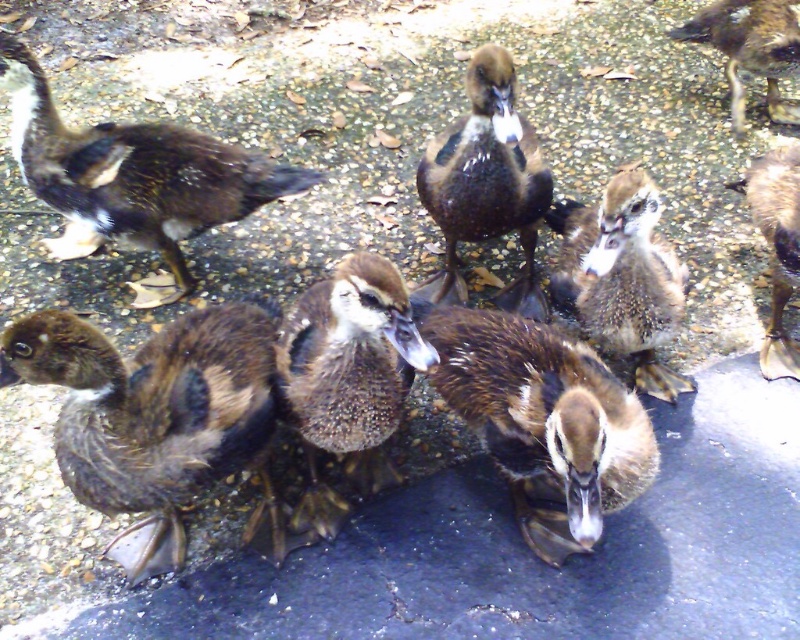
Question: Estimate the real-world distances between objects in this image. Which object is farther from the speckled feather duckling at center?

Choices:
 (A) brown fuzzy duckling at lower left
 (B) brown speckled duckling at center
 (C) brown fuzzy duckling at center
 (D) brown fuzzy duckling at right

Answer: (A)

Question: Among these objects, which one is farthest from the camera?

Choices:
 (A) speckled brown duckling at upper center
 (B) brown fuzzy duckling at right
 (C) brown speckled feathers at left

Answer: (A)

Question: Which object is the farthest from the brown fuzzy duckling at right?

Choices:
 (A) speckled feather duckling at center
 (B) brown fuzzy duckling at center
 (C) brown glossy duckling at center

Answer: (B)

Question: Is brown fuzzy duckling at lower left positioned in front of brown speckled duckling at center?

Choices:
 (A) yes
 (B) no

Answer: (A)

Question: Is speckled feather duckling at center to the right of speckled brown duckling at upper center from the viewer's perspective?

Choices:
 (A) no
 (B) yes

Answer: (A)

Question: Is brown fuzzy duckling at center below brown glossy duckling at center?

Choices:
 (A) no
 (B) yes

Answer: (B)